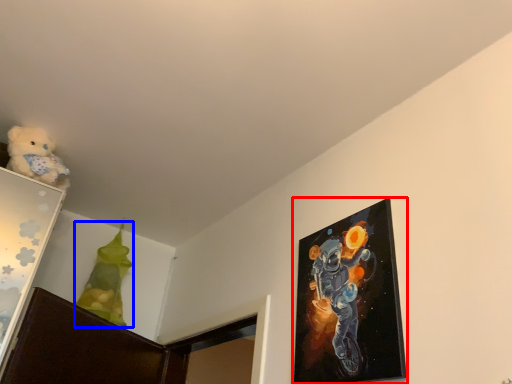
Question: Which of the following is the closest to the observer, picture frame (highlighted by a red box) or toy (highlighted by a blue box)?

Choices:
 (A) picture frame
 (B) toy

Answer: (A)